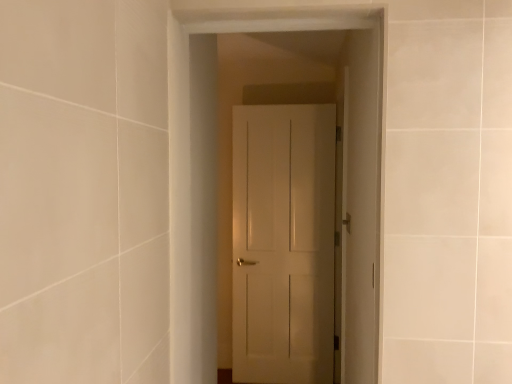
You are a GUI agent. You are given a task and a screenshot of the screen. Output one action in this format:
    pyautogui.click(x=<x>, y=<y>)
    Task: Click on the white matte door at center
    
    Given the screenshot: What is the action you would take?
    pyautogui.click(x=283, y=243)

This screenshot has height=384, width=512. Describe the element at coordinates (283, 243) in the screenshot. I see `white matte door at center` at that location.

The width and height of the screenshot is (512, 384). Identify the location of white matte door at center. (283, 243).